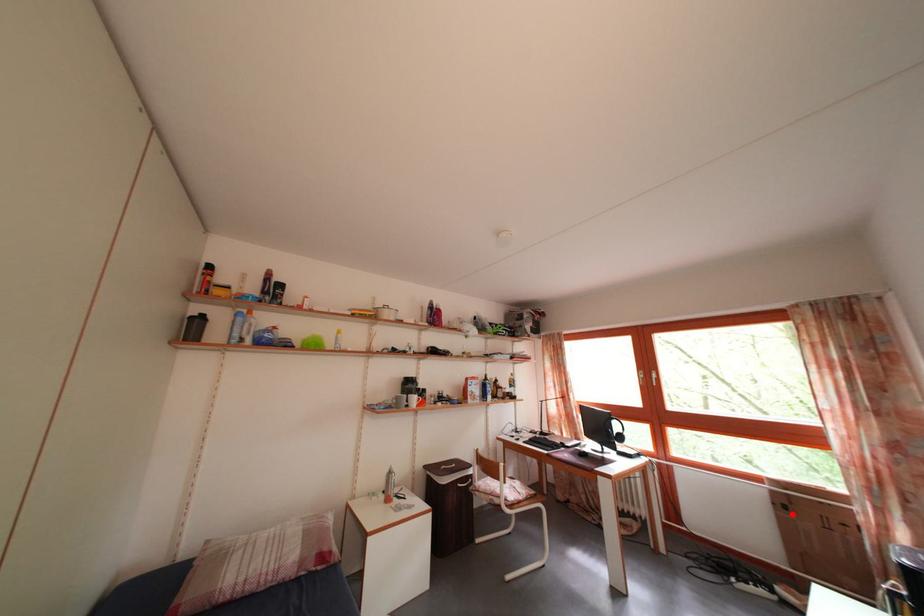
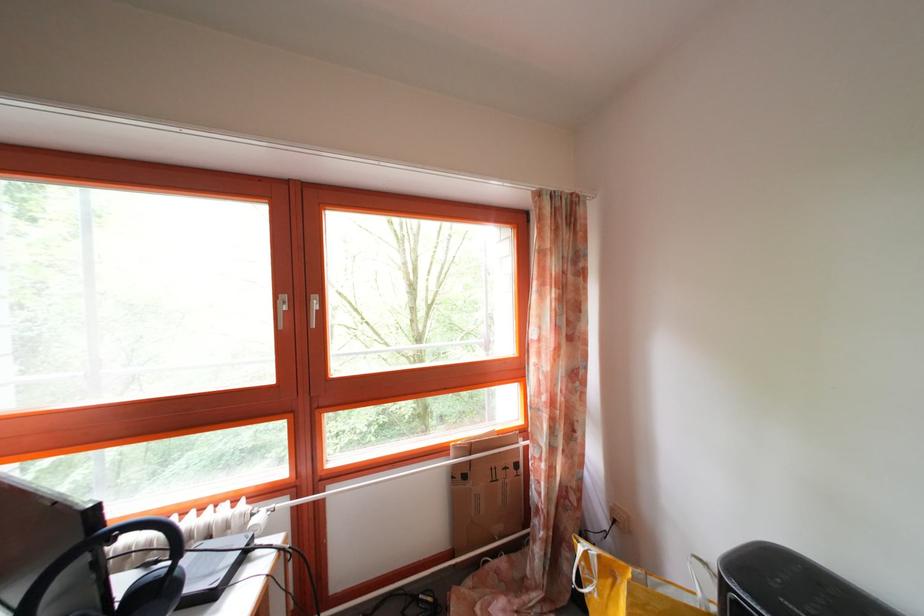
Find the pixel in the second image that matches the highlighted location in the first image.

(472, 484)